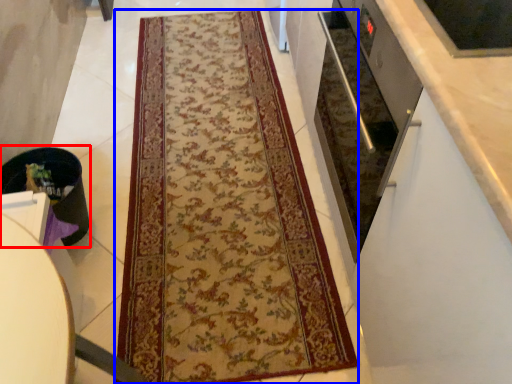
Question: Among these objects, which one is nearest to the camera, appliance (highlighted by a red box) or mat (highlighted by a blue box)?

Choices:
 (A) appliance
 (B) mat

Answer: (B)